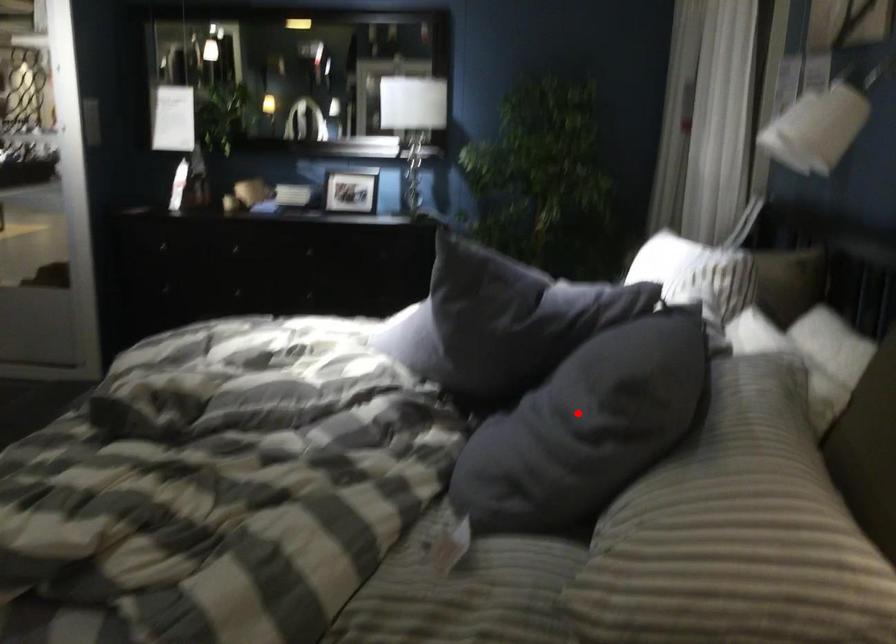
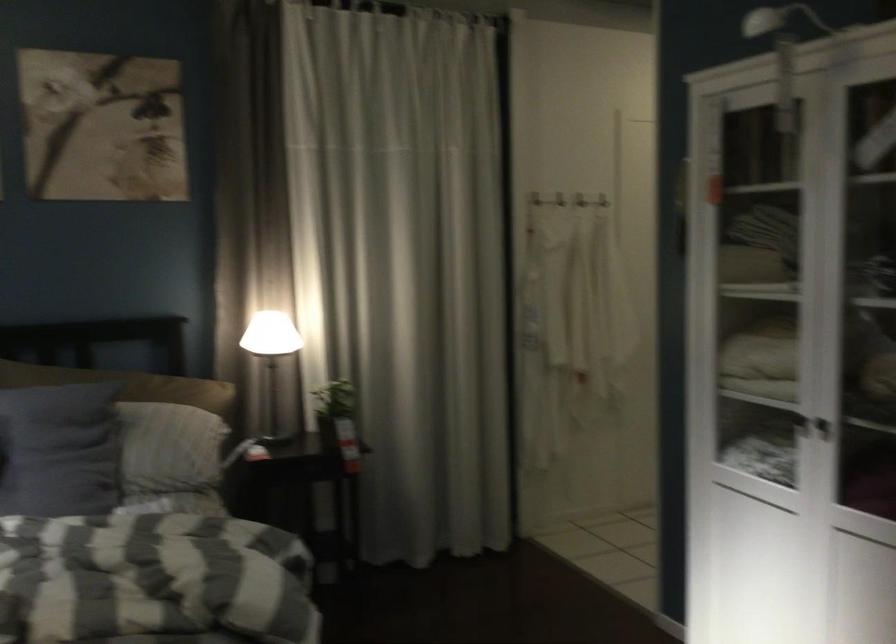
Question: I am providing you with two images of the same scene from different viewpoints. A red point is shown in image1. For the corresponding object point in image2, is it positioned nearer or farther from the camera?

Choices:
 (A) Nearer
 (B) Farther

Answer: (B)